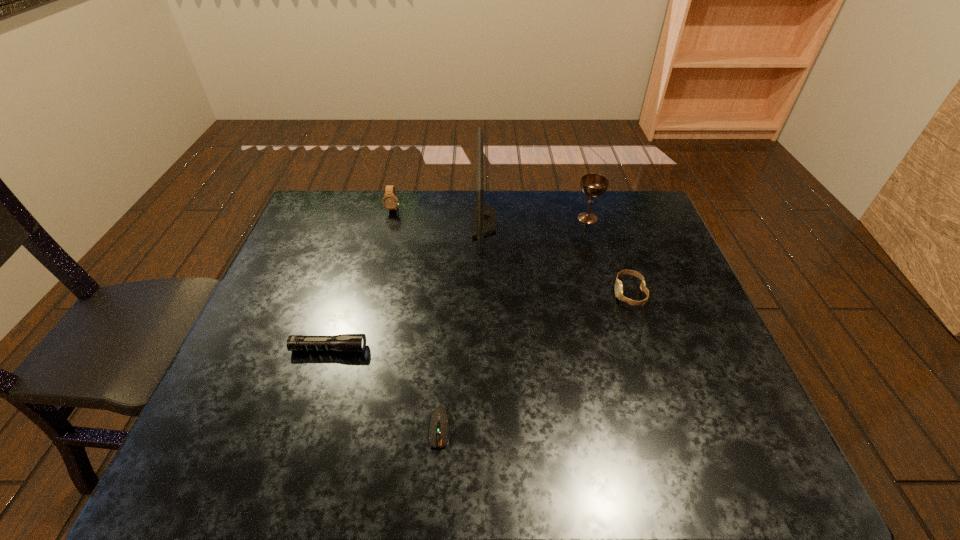
You are a GUI agent. You are given a task and a screenshot of the screen. Output one action in this format:
    pyautogui.click(x=<x>, y=<y>)
    Task: Click on the tallest object
    The height and width of the screenshot is (540, 960).
    Given the screenshot: What is the action you would take?
    pyautogui.click(x=484, y=221)

Identify the location of monitor. (484, 221).

At what (x,y) coordinates should I click in order to perform the action: click on the fifth shortest object. Please return your answer as a coordinate pair (x, y). The width and height of the screenshot is (960, 540). Looking at the image, I should click on (592, 185).

Locate an element on the screen. the farther watch is located at coordinates (390, 201).

Locate an element on the screen. The width and height of the screenshot is (960, 540). the taller watch is located at coordinates (390, 201).

Where is `the right watch`? the right watch is located at coordinates (618, 284).

You are a GUI agent. You are given a task and a screenshot of the screen. Output one action in this format:
    pyautogui.click(x=<x>, y=<y>)
    Task: Click on the fourth farthest object
    
    Given the screenshot: What is the action you would take?
    pyautogui.click(x=618, y=284)

Locate an element on the screen. flashlight is located at coordinates (344, 342).

Locate an element on the screen. The width and height of the screenshot is (960, 540). the fifth tallest object is located at coordinates (344, 342).

Where is `the nearest object`? the nearest object is located at coordinates (440, 418).